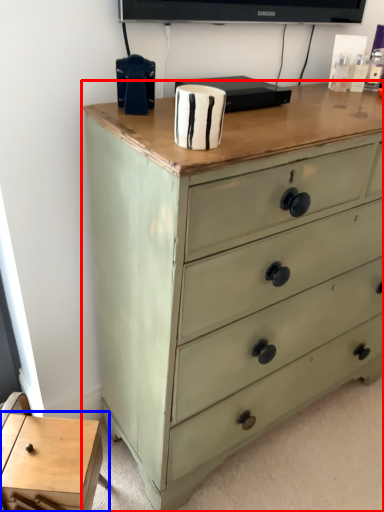
Question: Which point is further to the camera, chest of drawers (highlighted by a red box) or table (highlighted by a blue box)?

Choices:
 (A) chest of drawers
 (B) table

Answer: (B)